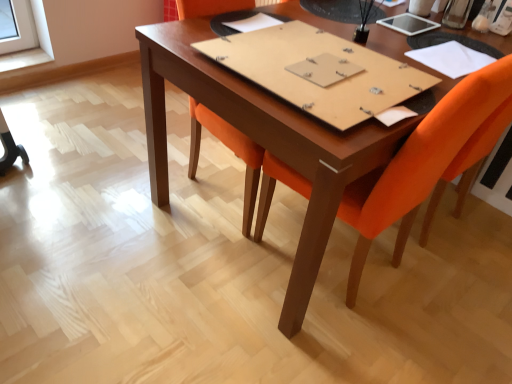
Question: Would you say white paper at upper right, the third notebook when ordered from left to right, is a long distance from brown cardboard notebook at center, which is the 2th notebook in right-to-left order?

Choices:
 (A) no
 (B) yes

Answer: (A)

Question: Would you say brown cardboard notebook at center, acting as the second notebook starting from the left, is part of white paper at upper right, the third notebook when ordered from left to right,'s contents?

Choices:
 (A) yes
 (B) no

Answer: (B)

Question: Is white paper at upper right, the third notebook when ordered from left to right, closer to the viewer compared to brown cardboard notebook at center, which is the 2th notebook in right-to-left order?

Choices:
 (A) yes
 (B) no

Answer: (B)

Question: Is white paper at upper right, the third notebook when ordered from left to right, taller than brown cardboard notebook at center, which is the 2th notebook in right-to-left order?

Choices:
 (A) yes
 (B) no

Answer: (B)

Question: Can you confirm if white paper at upper right, the third notebook when ordered from left to right, is smaller than brown cardboard notebook at center, which is the 2th notebook in right-to-left order?

Choices:
 (A) yes
 (B) no

Answer: (A)

Question: Considering the positions of white paper at center, the third notebook viewed from the right, and white paper at upper right, the first notebook in the right-to-left sequence, in the image, is white paper at center, the third notebook viewed from the right, taller or shorter than white paper at upper right, the first notebook in the right-to-left sequence,?

Choices:
 (A) short
 (B) tall

Answer: (A)

Question: Considering the positions of point (237, 23) and point (462, 64), is point (237, 23) closer or farther from the camera than point (462, 64)?

Choices:
 (A) farther
 (B) closer

Answer: (A)

Question: Is white paper at center, the third notebook viewed from the right, bigger or smaller than white paper at upper right, the first notebook in the right-to-left sequence?

Choices:
 (A) small
 (B) big

Answer: (A)

Question: Considering the relative positions of white paper at center, which is the 1th notebook from left to right, and white paper at upper right, the third notebook when ordered from left to right, in the image provided, is white paper at center, which is the 1th notebook from left to right, to the left or to the right of white paper at upper right, the third notebook when ordered from left to right,?

Choices:
 (A) left
 (B) right

Answer: (A)

Question: Considering the positions of point (487, 54) and point (344, 94), is point (487, 54) closer or farther from the camera than point (344, 94)?

Choices:
 (A) closer
 (B) farther

Answer: (B)

Question: Is white paper at upper right, the third notebook when ordered from left to right, bigger or smaller than brown cardboard notebook at center, which is the 2th notebook in right-to-left order?

Choices:
 (A) small
 (B) big

Answer: (A)

Question: Which is correct: white paper at upper right, the first notebook in the right-to-left sequence, is inside brown cardboard notebook at center, which is the 2th notebook in right-to-left order, or outside of it?

Choices:
 (A) outside
 (B) inside

Answer: (A)

Question: Considering the relative positions of white paper at upper right, the third notebook when ordered from left to right, and brown cardboard notebook at center, acting as the second notebook starting from the left, in the image provided, is white paper at upper right, the third notebook when ordered from left to right, to the left or to the right of brown cardboard notebook at center, acting as the second notebook starting from the left,?

Choices:
 (A) left
 (B) right

Answer: (B)

Question: Does point (229, 38) appear closer or farther from the camera than point (369, 193)?

Choices:
 (A) farther
 (B) closer

Answer: (A)

Question: Considering their positions, is brown cardboard notebook at center, which is the 2th notebook in right-to-left order, located in front of or behind orange fabric chair at center?

Choices:
 (A) behind
 (B) front

Answer: (A)